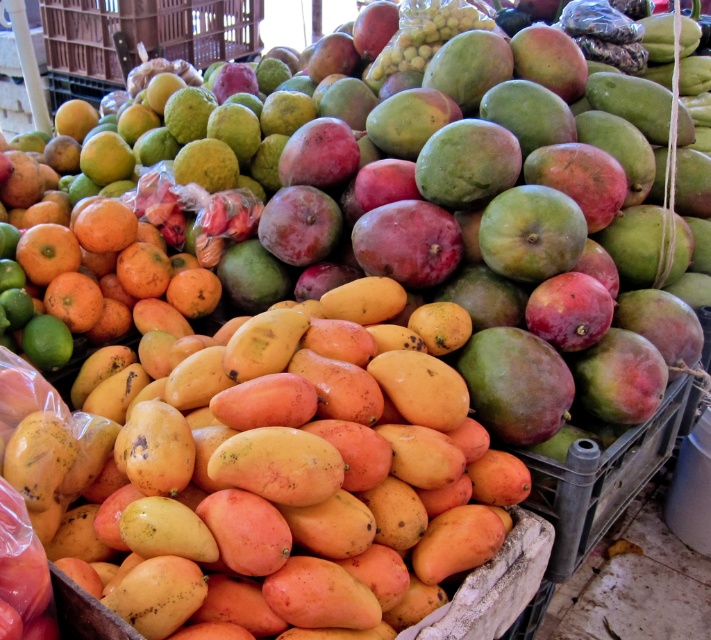
You are at a fruit market and want to pick up two mangoes located at specific coordinates. The first mango is at point (176, 547) and the second is at point (80, 252). Which mango should you pick up first if you want to collect them in the order they appear closest to you?

You should pick up the mango at point (176, 547) first because it is closer to you than the mango at point (80, 252).